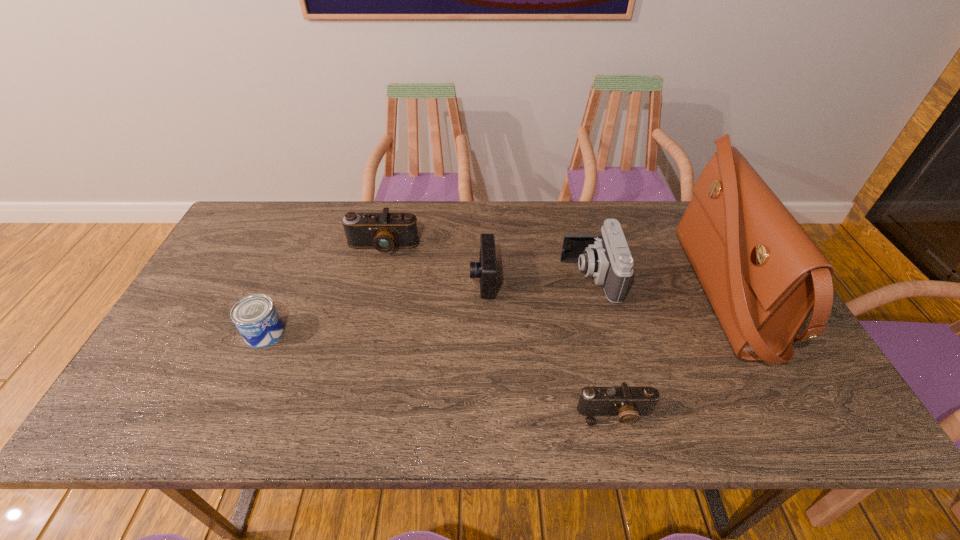
Image resolution: width=960 pixels, height=540 pixels. Identify the location of free space between the rightmost object and the shortest object. (670, 354).

Locate an element on the screen. free space between the can and the tallest object is located at coordinates (494, 314).

Find the location of a particular element. vacant space that is in between the can and the nearest camera is located at coordinates (440, 374).

Where is `vacant area between the shortest camera and the tallest object`? The height and width of the screenshot is (540, 960). vacant area between the shortest camera and the tallest object is located at coordinates (670, 354).

Locate an element on the screen. Image resolution: width=960 pixels, height=540 pixels. the second closest object to the rightmost object is located at coordinates (628, 403).

Identify which object is located as the nearest to the second camera from left to right. Please provide its 2D coordinates. Your answer should be formatted as a tuple, i.e. [(x, y)], where the tuple contains the x and y coordinates of a point satisfying the conditions above.

[(385, 231)]

Find the location of a particular element. This screenshot has width=960, height=540. the fourth closest camera relative to the leftmost object is located at coordinates (606, 257).

Find the location of a particular element. the third closest camera to the third object from left to right is located at coordinates (628, 403).

The height and width of the screenshot is (540, 960). Find the location of `free space that satisfies the following two spatial constraints: 1. on the front flap of the rightmost object; 2. on the front-facing side of the shortest object`. free space that satisfies the following two spatial constraints: 1. on the front flap of the rightmost object; 2. on the front-facing side of the shortest object is located at coordinates coord(788,415).

Where is `free spot that satisfies the following two spatial constraints: 1. at the front of the second tallest object with an open lens cover; 2. on the front-facing side of the nearest camera`? The width and height of the screenshot is (960, 540). free spot that satisfies the following two spatial constraints: 1. at the front of the second tallest object with an open lens cover; 2. on the front-facing side of the nearest camera is located at coordinates (624, 415).